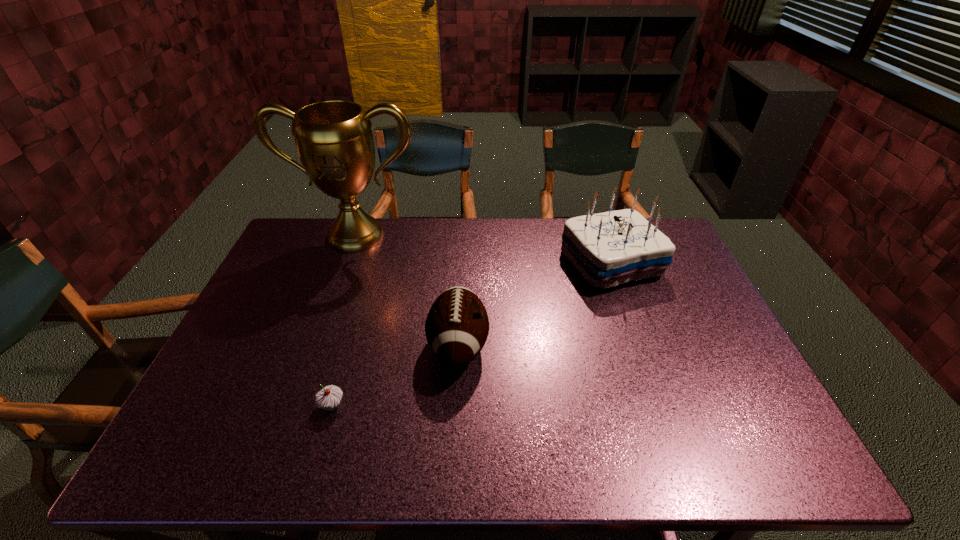
Point out which object is positioned as the third nearest to the third object from left to right. Please provide its 2D coordinates. Your answer should be formatted as a tuple, i.e. [(x, y)], where the tuple contains the x and y coordinates of a point satisfying the conditions above.

[(334, 140)]

This screenshot has width=960, height=540. Find the location of `free location that satisfies the following two spatial constraints: 1. on the surface of the rightmost object with symbols; 2. on the left side of the tallest object`. free location that satisfies the following two spatial constraints: 1. on the surface of the rightmost object with symbols; 2. on the left side of the tallest object is located at coordinates (347, 262).

The image size is (960, 540). In order to click on free space that satisfies the following two spatial constraints: 1. on the surface of the tallest object with symbols; 2. on the right side of the shortest object in this screenshot , I will do `click(295, 406)`.

Image resolution: width=960 pixels, height=540 pixels. In order to click on free spot that satisfies the following two spatial constraints: 1. on the surface of the second shortest object with symbols; 2. on the left side of the tallest object in this screenshot , I will do `click(316, 346)`.

Where is `blank space that satisfies the following two spatial constraints: 1. on the surface of the rightmost object with symbols; 2. on the left side of the trophy cup`? The width and height of the screenshot is (960, 540). blank space that satisfies the following two spatial constraints: 1. on the surface of the rightmost object with symbols; 2. on the left side of the trophy cup is located at coordinates (347, 262).

Image resolution: width=960 pixels, height=540 pixels. Identify the location of free region that satisfies the following two spatial constraints: 1. on the surface of the third farthest object with symbols; 2. on the left side of the tallest object. (316, 346).

Image resolution: width=960 pixels, height=540 pixels. Identify the location of free spot that satisfies the following two spatial constraints: 1. on the back side of the cupcake; 2. on the left side of the birthday cake. (373, 262).